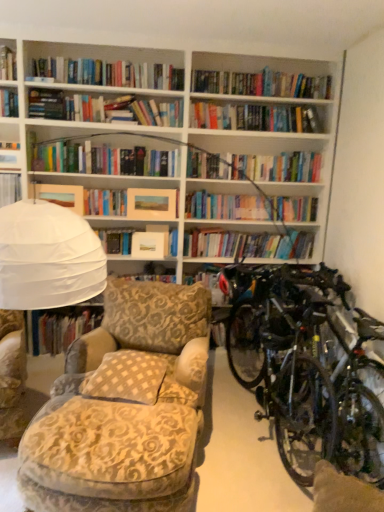
Question: In the image, is hardcover book at center, which is the second book from top to bottom, positioned in front of or behind matte paper book at center, positioned as the 2th paperback book in right-to-left order?

Choices:
 (A) front
 (B) behind

Answer: (A)

Question: From the image's perspective, relative to matte paper book at center, positioned as the 2th paperback book in right-to-left order, is hardcover book at center, acting as the second book starting from the front, above or below?

Choices:
 (A) above
 (B) below

Answer: (B)

Question: Which of these objects is positioned closest to the hardcover book at center, which is the second book from top to bottom?

Choices:
 (A) hardcover book at upper left, which is the 1th book from front to back
 (B) matte paper book at center, positioned as the 2th paperback book in right-to-left order
 (C) matte paper picture frame at center, the 1th paperback book in the right-to-left sequence
 (D) beige textured pillow at center
 (E) matte yellow paper at upper left, which is the 1th paperback book from left to right

Answer: (B)

Question: Which of these objects is positioned farthest from the matte paper picture frame at center, which is the 3th paperback book in left-to-right order?

Choices:
 (A) beige textured pillow at center
 (B) matte paper book at center, positioned as the 2th paperback book in right-to-left order
 (C) shiny metallic bicycles at right
 (D) hardcover book at center, which is counted as the second book, starting from the left
 (E) matte yellow paper at upper left, which is the 1th paperback book from left to right

Answer: (A)